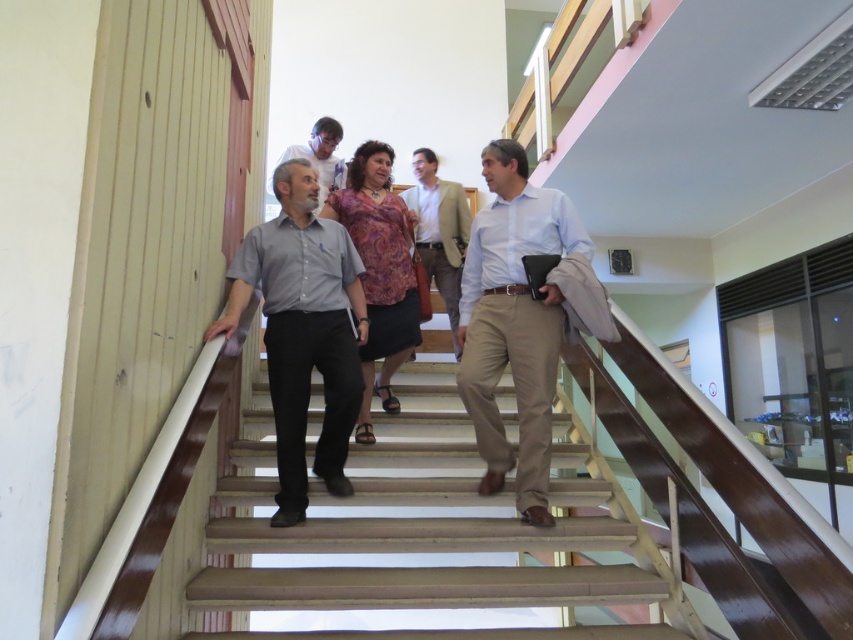
You are standing at the bottom of the staircase and want to hand a document to the man in the gray matte shirt at center. If you can throw the document up to a maximum distance of 2.5 meters, will you be able to reach him?

The gray matte shirt at center and viewer are 2.44 meters apart from each other. Since the maximum throwing distance is 2.5 meters, you can successfully throw the document to reach the gray matte shirt at center.

You are standing at the bottom of the staircase and want to hand a document to the person wearing the light blue shirt at center. Which direction should you move to reach them before they pass the matte gray shirt at center?

You should move forward towards the staircase since the light blue shirt at center is in front of the matte gray shirt at center, meaning they are ahead in the group and moving upwards. To reach them before they pass the matte gray shirt at center, you need to ascend the stairs quickly to intercept them as they climb.